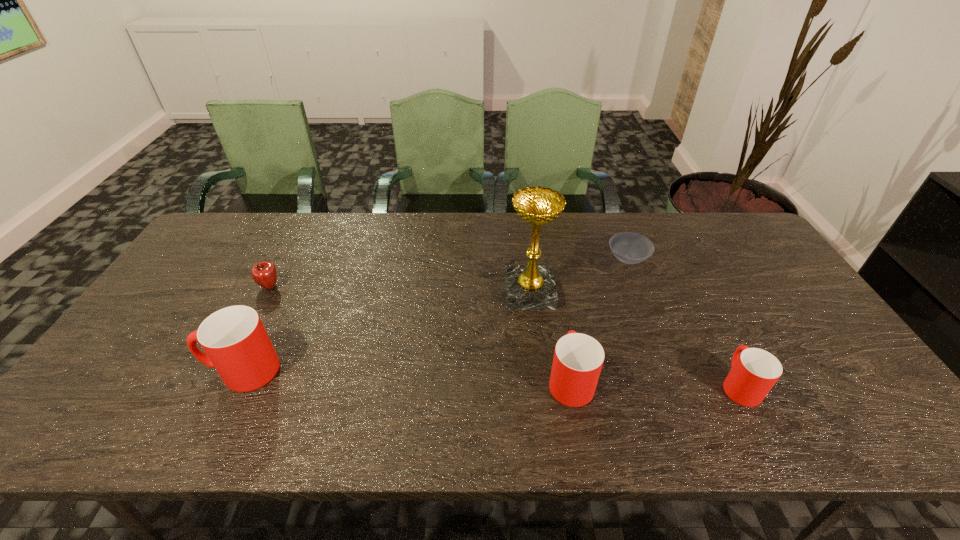
Image resolution: width=960 pixels, height=540 pixels. I want to click on blank region between the shortest cup and the leftmost cup, so click(491, 378).

Locate an element on the screen. vacant point located between the rightmost object and the award is located at coordinates (635, 339).

In order to click on vacant space in between the award and the second shortest object in this screenshot , I will do `click(399, 290)`.

I want to click on vacant area that lies between the third tallest object and the second object from right to left, so click(599, 320).

Where is `unoccupied position between the award and the apple`? The image size is (960, 540). unoccupied position between the award and the apple is located at coordinates (399, 290).

Find the location of a particular element. Image resolution: width=960 pixels, height=540 pixels. free spot between the tallest cup and the second tallest cup is located at coordinates (406, 375).

This screenshot has width=960, height=540. Find the location of `vacant space that's between the leftmost cup and the tallest object`. vacant space that's between the leftmost cup and the tallest object is located at coordinates (386, 332).

This screenshot has width=960, height=540. I want to click on vacant area that lies between the award and the second shortest cup, so click(x=550, y=336).

You are a GUI agent. You are given a task and a screenshot of the screen. Output one action in this format:
    pyautogui.click(x=<x>, y=<y>)
    Task: Click on the object that can be found as the third closest to the shortest cup
    
    Given the screenshot: What is the action you would take?
    pyautogui.click(x=531, y=287)

This screenshot has height=540, width=960. In order to click on the fourth closest object to the second tallest object in this screenshot , I will do `click(631, 248)`.